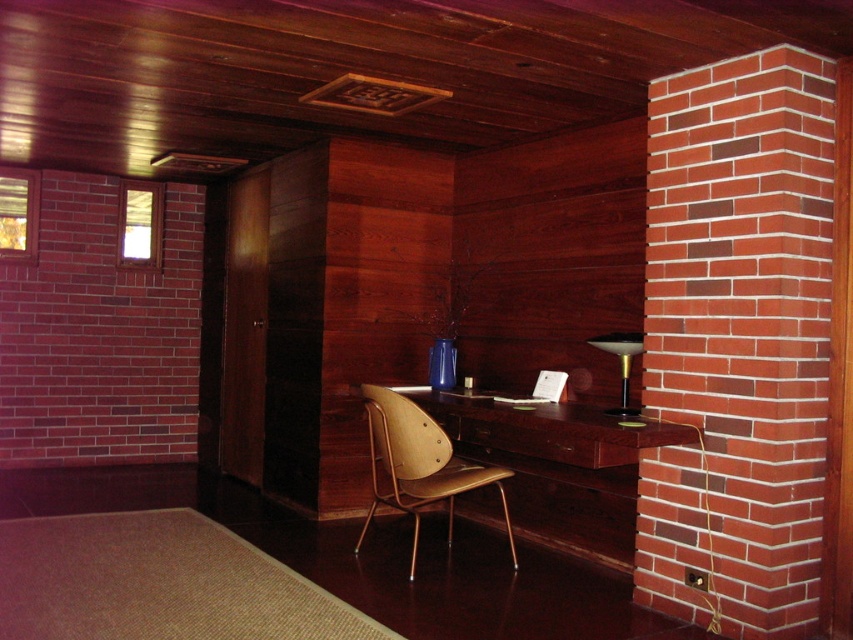
Question: Which point is farther to the camera?

Choices:
 (A) coord(408,400)
 (B) coord(608,337)
 (C) coord(660,426)

Answer: (A)

Question: Is brown wood desk at center to the right of matte wood chair at center from the viewer's perspective?

Choices:
 (A) yes
 (B) no

Answer: (A)

Question: Can you confirm if matte wood chair at center is smaller than matte gold lamp at right?

Choices:
 (A) yes
 (B) no

Answer: (B)

Question: Does matte wood chair at center appear on the left side of matte gold lamp at right?

Choices:
 (A) no
 (B) yes

Answer: (B)

Question: Which point is closer to the camera?

Choices:
 (A) matte wood chair at center
 (B) brown wood desk at center

Answer: (B)

Question: Among these objects, which one is nearest to the camera?

Choices:
 (A) matte gold lamp at right
 (B) matte wood chair at center
 (C) brown wood desk at center

Answer: (C)